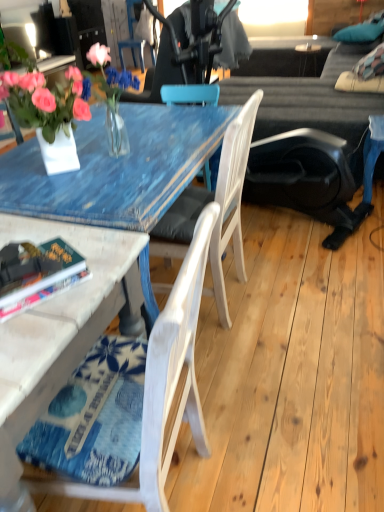
Locate an element on the screen. The height and width of the screenshot is (512, 384). free space in front of hardcover book at lower left is located at coordinates (36, 332).